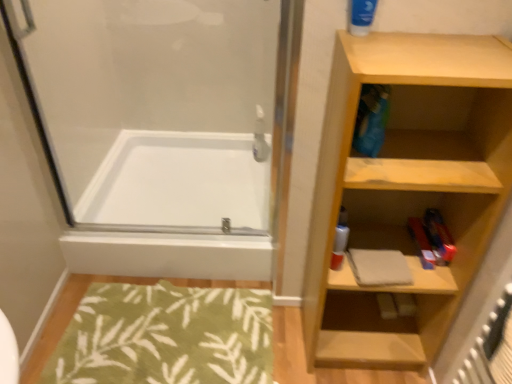
Question: Could you tell me if blue matte tube at upper right is facing green leafy rug at lower left?

Choices:
 (A) yes
 (B) no

Answer: (B)

Question: From a real-world perspective, does blue matte tube at upper right sit lower than green leafy rug at lower left?

Choices:
 (A) yes
 (B) no

Answer: (B)

Question: From the image's perspective, would you say blue matte tube at upper right is positioned over green leafy rug at lower left?

Choices:
 (A) no
 (B) yes

Answer: (B)

Question: Does blue matte tube at upper right lie behind green leafy rug at lower left?

Choices:
 (A) no
 (B) yes

Answer: (A)

Question: Does blue matte tube at upper right have a lesser height compared to green leafy rug at lower left?

Choices:
 (A) yes
 (B) no

Answer: (B)

Question: From the image's perspective, is wooden shelf at right located above or below white glossy bathtub at center?

Choices:
 (A) above
 (B) below

Answer: (B)

Question: Considering the positions of wooden shelf at right and white glossy bathtub at center in the image, is wooden shelf at right taller or shorter than white glossy bathtub at center?

Choices:
 (A) short
 (B) tall

Answer: (B)

Question: From a real-world perspective, relative to white glossy bathtub at center, is wooden shelf at right vertically above or below?

Choices:
 (A) below
 (B) above

Answer: (B)

Question: Is point (334, 81) closer or farther from the camera than point (181, 135)?

Choices:
 (A) closer
 (B) farther

Answer: (A)

Question: From a real-world perspective, is white glossy bathtub at center above or below wooden shelf at right?

Choices:
 (A) above
 (B) below

Answer: (B)

Question: Considering their positions, is white glossy bathtub at center located in front of or behind wooden shelf at right?

Choices:
 (A) front
 (B) behind

Answer: (B)

Question: Is point (234, 256) positioned closer to the camera than point (478, 147)?

Choices:
 (A) closer
 (B) farther

Answer: (B)

Question: Choose the correct answer: Is white glossy bathtub at center inside wooden shelf at right or outside it?

Choices:
 (A) inside
 (B) outside

Answer: (B)

Question: Considering the positions of green leafy rug at lower left and blue matte tube at upper right in the image, is green leafy rug at lower left bigger or smaller than blue matte tube at upper right?

Choices:
 (A) big
 (B) small

Answer: (A)

Question: In terms of width, does green leafy rug at lower left look wider or thinner when compared to blue matte tube at upper right?

Choices:
 (A) thin
 (B) wide

Answer: (B)